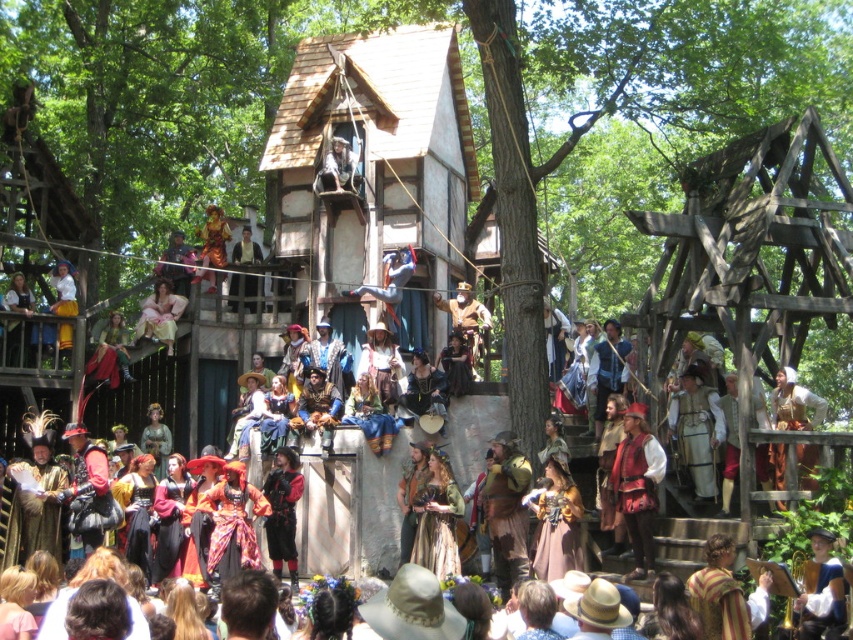
You are a guest at this medieval event and want to locate the person wearing the velvet red vest at center. Where should you look relative to the gold textured fabric at center?

The velvet red vest at center is to the left of the gold textured fabric at center.

What object is located at the coordinates point (637, 484) in the scene?

The point (637, 484) corresponds to the matte red vest at center.